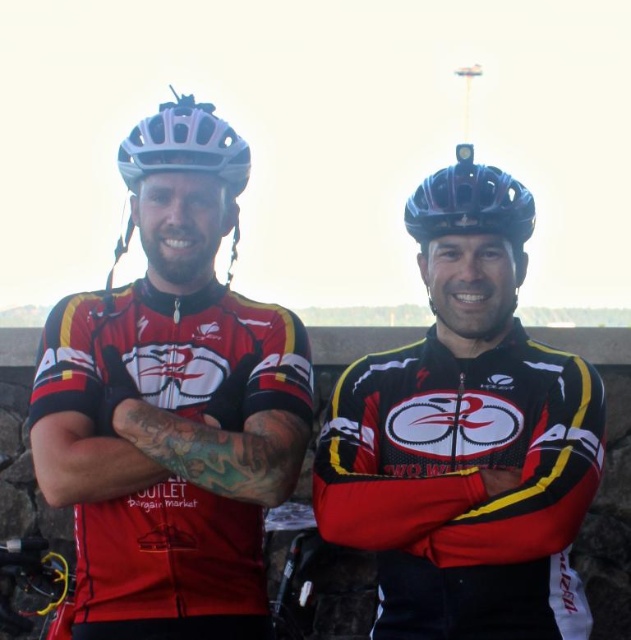
Is point (83, 608) closer to viewer compared to point (221, 132)?

Yes, point (83, 608) is closer to viewer.

Does matte black cycling jersey at left appear over white matte bicycle helmet at upper left?

Incorrect, matte black cycling jersey at left is not positioned above white matte bicycle helmet at upper left.

Does point (124, 474) come in front of point (177, 140)?

That is True.

This screenshot has height=640, width=631. In order to click on matte black cycling jersey at left in this screenshot , I will do `click(172, 404)`.

Who is shorter, white matte helmet at left or white matte bicycle helmet at upper left?

white matte bicycle helmet at upper left

Is the position of white matte helmet at left less distant than that of white matte bicycle helmet at upper left?

No, white matte helmet at left is further to the viewer.

At what (x,y) coordinates should I click in order to perform the action: click on white matte helmet at left. Please return your answer as a coordinate pair (x, y). Looking at the image, I should click on (184, 145).

Is matte black cycling jersey at center in front of white matte bicycle helmet at upper left?

Yes, matte black cycling jersey at center is closer to the viewer.

Who is positioned more to the right, matte black cycling jersey at center or white matte bicycle helmet at upper left?

matte black cycling jersey at center

The image size is (631, 640). What are the coordinates of `matte black cycling jersey at center` in the screenshot? It's located at (466, 436).

Locate an element on the screen. This screenshot has height=640, width=631. matte black cycling jersey at center is located at coordinates (466, 436).